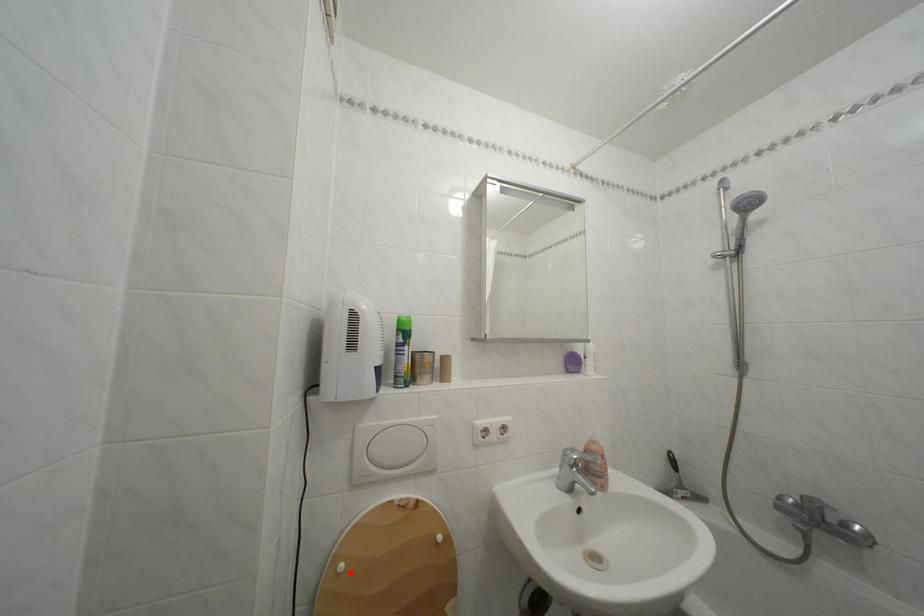
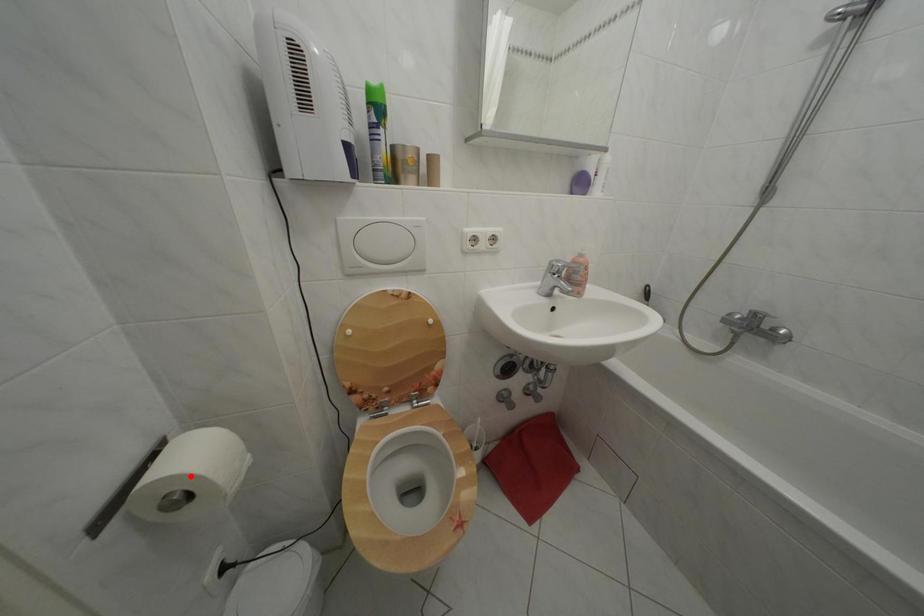
I am providing you with two images of the same scene from different viewpoints. A red point is marked on the first image and another point is marked on the second image. Is the marked point in image1 the same physical position as the marked point in image2?

No